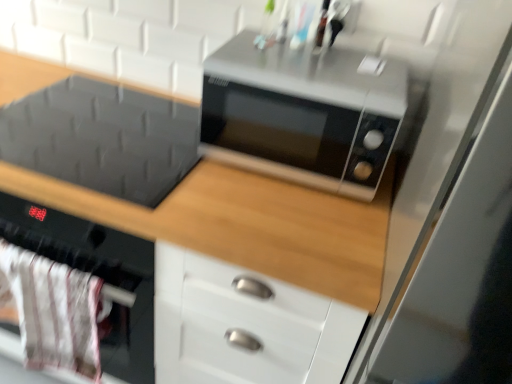
Where is `empty space that is ontop of satin silver microwave at center`? The width and height of the screenshot is (512, 384). empty space that is ontop of satin silver microwave at center is located at coordinates (319, 53).